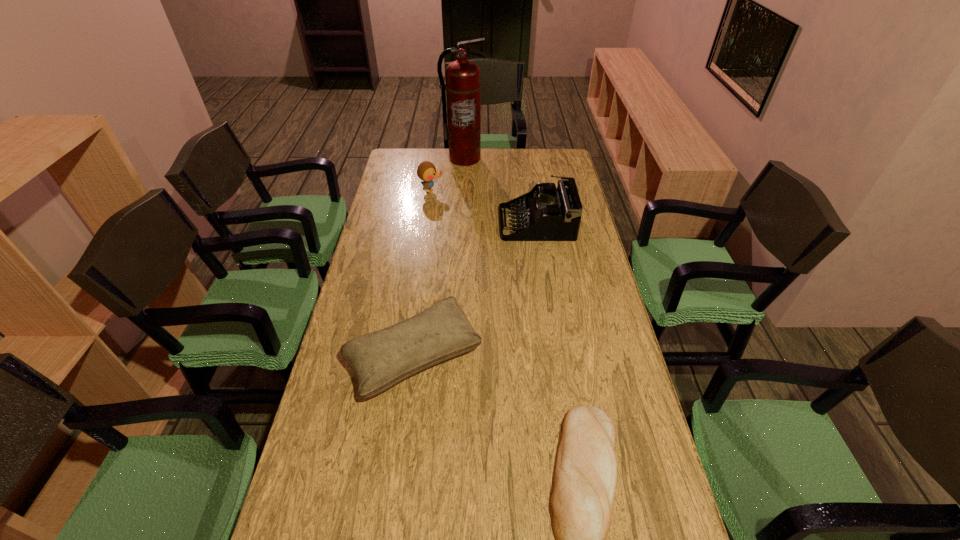
What are the coordinates of `vacant area between the tallest object and the second nearest object` in the screenshot? It's located at (440, 257).

At what (x,y) coordinates should I click in order to perform the action: click on vacant area between the tallest object and the second farthest object. Please return your answer as a coordinate pair (x, y). Looking at the image, I should click on (447, 175).

What are the coordinates of `free space between the tallest object and the typewriter` in the screenshot? It's located at (500, 191).

What are the coordinates of `free space between the typewriter and the farthest object` in the screenshot? It's located at (500, 191).

In order to click on blank region between the duck and the cushion in this screenshot , I will do `click(422, 273)`.

Where is `empty space between the third nearest object and the cushion`? Image resolution: width=960 pixels, height=540 pixels. empty space between the third nearest object and the cushion is located at coordinates (475, 289).

Locate an element on the screen. Image resolution: width=960 pixels, height=540 pixels. the third closest object relative to the shortest object is located at coordinates (426, 171).

Identify which object is the fourth nearest to the farthest object. Please provide its 2D coordinates. Your answer should be formatted as a tuple, i.e. [(x, y)], where the tuple contains the x and y coordinates of a point satisfying the conditions above.

[(586, 470)]

I want to click on vacant point that satisfies the following two spatial constraints: 1. on the side of the farthest object with the handle and hose; 2. on the front-facing side of the duck, so click(x=463, y=191).

The height and width of the screenshot is (540, 960). I want to click on free spot that satisfies the following two spatial constraints: 1. on the front-facing side of the second nearest object; 2. on the right side of the fourth nearest object, so click(407, 356).